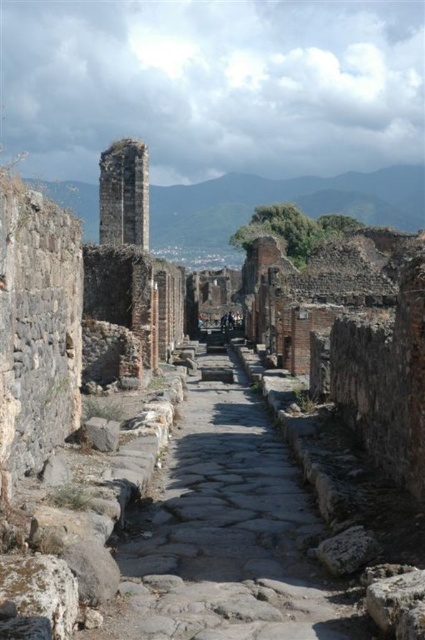
Question: Is gray stone path at center to the left of rusty stone tower at upper left from the viewer's perspective?

Choices:
 (A) yes
 (B) no

Answer: (B)

Question: Does gray stone path at center lie in front of rusty stone tower at upper left?

Choices:
 (A) yes
 (B) no

Answer: (A)

Question: Which point appears farthest from the camera in this image?

Choices:
 (A) (135, 244)
 (B) (226, 532)

Answer: (A)

Question: Which object appears farthest from the camera in this image?

Choices:
 (A) gray stone path at center
 (B) rusty stone tower at upper left

Answer: (B)

Question: Considering the relative positions of gray stone path at center and rusty stone tower at upper left in the image provided, where is gray stone path at center located with respect to rusty stone tower at upper left?

Choices:
 (A) below
 (B) above

Answer: (A)